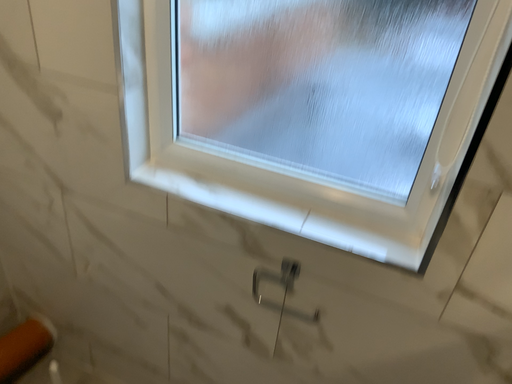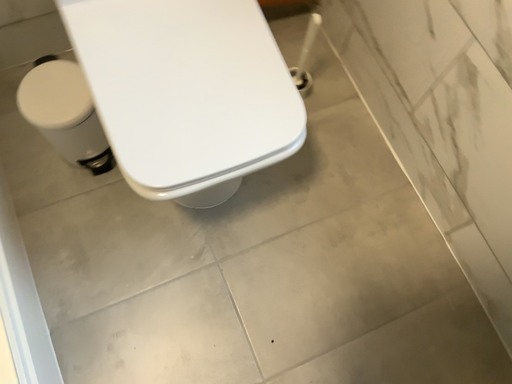
Question: Which way did the camera rotate in the video?

Choices:
 (A) rotated right
 (B) rotated left

Answer: (B)